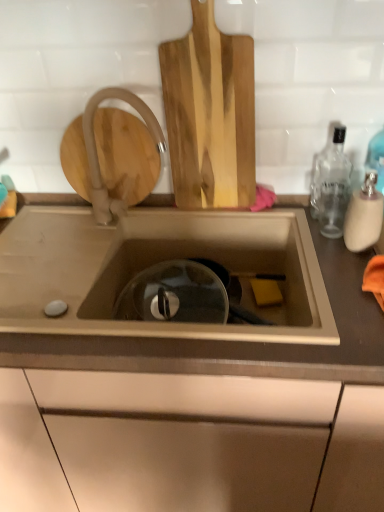
You are a GUI agent. You are given a task and a screenshot of the screen. Output one action in this format:
    pyautogui.click(x=<x>, y=<y>)
    Task: Click on the free space to the left of matte white faucet at upper left
    This screenshot has width=384, height=512.
    Given the screenshot: What is the action you would take?
    pyautogui.click(x=49, y=218)